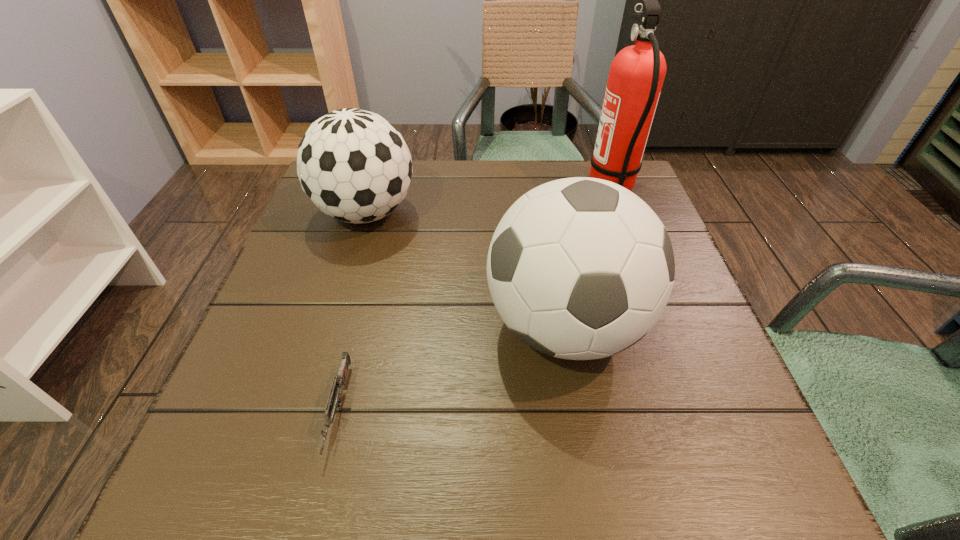
Find the location of a particular element. The width and height of the screenshot is (960, 540). blank area located 0.070m on the front of the shorter soccer ball is located at coordinates (349, 268).

Locate an element on the screen. This screenshot has width=960, height=540. fire extinguisher situated at the far edge is located at coordinates (636, 76).

Image resolution: width=960 pixels, height=540 pixels. I want to click on soccer ball present at the far edge, so click(355, 166).

Locate an element on the screen. The image size is (960, 540). object at the near edge is located at coordinates (335, 397).

Identify the location of object situated at the left edge. (355, 166).

I want to click on fire extinguisher that is positioned at the right edge, so click(x=636, y=76).

Identify the location of soccer ball at the right edge. This screenshot has height=540, width=960. (580, 268).

I want to click on object situated at the far left corner, so click(355, 166).

You are a GUI agent. You are given a task and a screenshot of the screen. Output one action in this format:
    pyautogui.click(x=<x>, y=<y>)
    Task: Click on the object that is at the far right corner
    
    Given the screenshot: What is the action you would take?
    pyautogui.click(x=636, y=76)

This screenshot has height=540, width=960. Find the location of `vacant region at the far edge of the desktop`. vacant region at the far edge of the desktop is located at coordinates (491, 176).